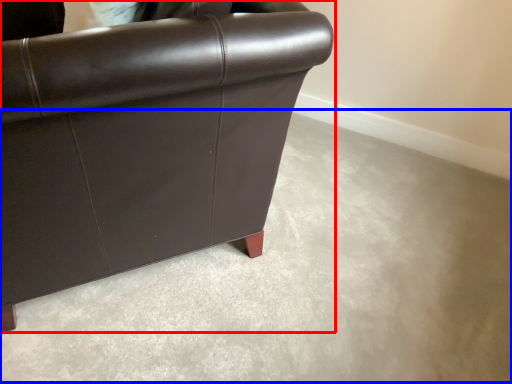
Question: Which object is further to the camera taking this photo, chair (highlighted by a red box) or concrete (highlighted by a blue box)?

Choices:
 (A) chair
 (B) concrete

Answer: (B)